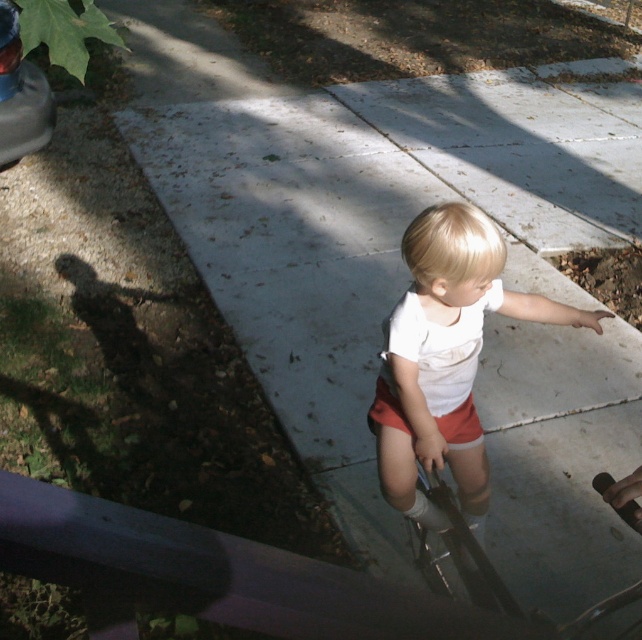
You are a fashion designer observing a child wearing two pairs of shorts. The child has white matte shorts at center and orange cotton shorts at center. Which pair is positioned to the right?

The white matte shorts at center are to the right of the orange cotton shorts at center.

The scene shows a child standing on a concrete surface near a purple railing. There is a point marked at coordinates (446,356). What object is located at that point?

The point at coordinates (446,356) marks the white matte shorts at center.

You are a photographer trying to capture the orange cotton shorts at center and the shiny concrete puddle at lower right in the same frame. Based on the scene, which object occupies a larger horizontal space in the image?

The shiny concrete puddle at lower right is wider than the orange cotton shorts at center, so it occupies a larger horizontal space in the image.